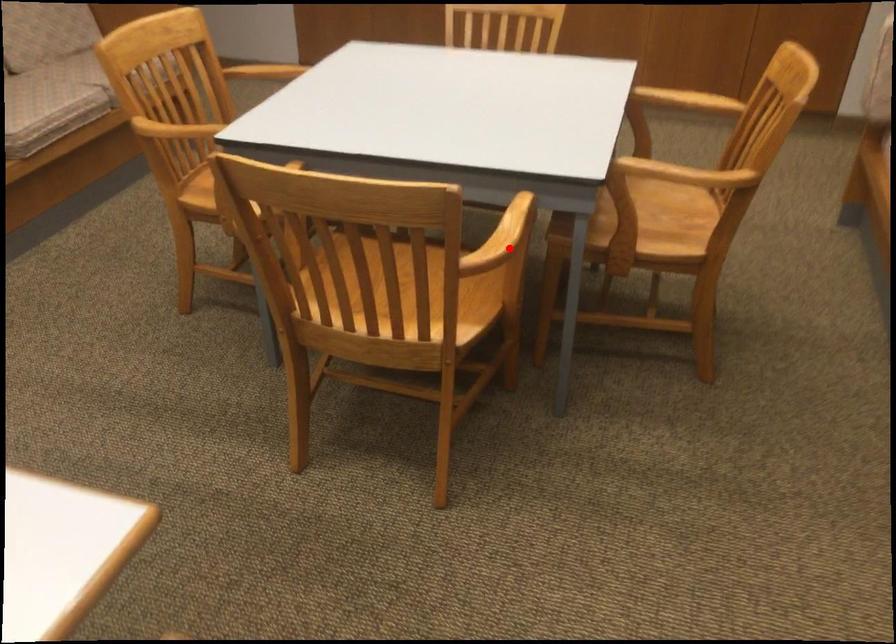
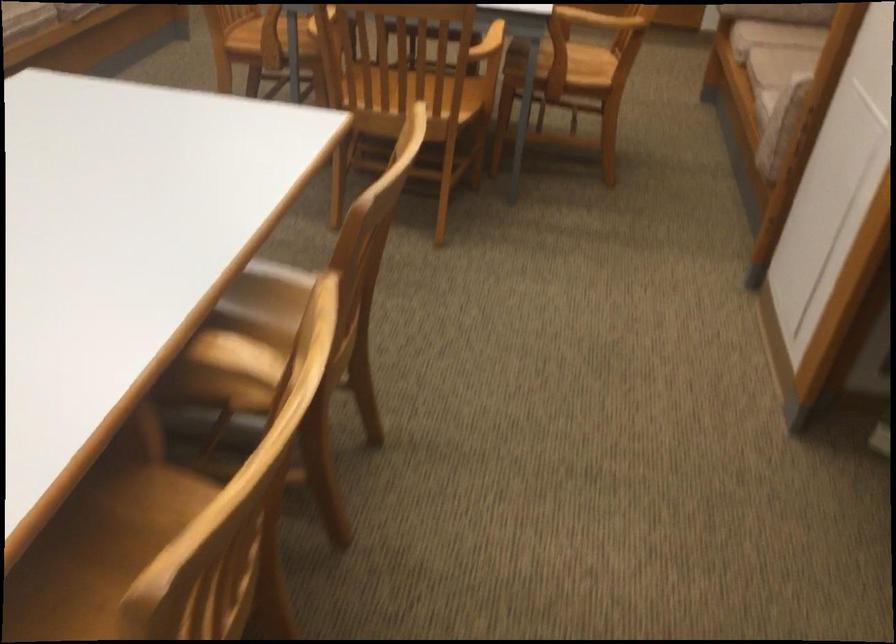
Locate, in the second image, the point that corresponds to the highlighted location in the first image.

(488, 43)